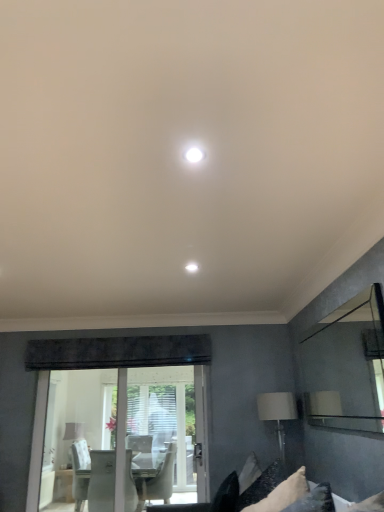
Question: Considering the relative sizes of white glossy light fixture at center and clear glass mirror at right in the image provided, is white glossy light fixture at center wider than clear glass mirror at right?

Choices:
 (A) no
 (B) yes

Answer: (B)

Question: From a real-world perspective, is white glossy light fixture at center physically below clear glass mirror at right?

Choices:
 (A) yes
 (B) no

Answer: (B)

Question: From the image's perspective, does white glossy light fixture at center appear lower than clear glass mirror at right?

Choices:
 (A) yes
 (B) no

Answer: (B)

Question: Would you consider white glossy light fixture at center to be distant from clear glass mirror at right?

Choices:
 (A) no
 (B) yes

Answer: (B)

Question: Considering the relative positions of white glossy light fixture at center and clear glass mirror at right in the image provided, is white glossy light fixture at center in front of clear glass mirror at right?

Choices:
 (A) yes
 (B) no

Answer: (A)

Question: From the image's perspective, would you say white glossy light fixture at center is positioned over clear glass mirror at right?

Choices:
 (A) no
 (B) yes

Answer: (B)

Question: Could you tell me if white glossy light fixture at center is facing white fabric pillow at lower right?

Choices:
 (A) yes
 (B) no

Answer: (B)

Question: Can you confirm if white glossy light fixture at center is thinner than white fabric pillow at lower right?

Choices:
 (A) yes
 (B) no

Answer: (A)

Question: From the image's perspective, is white glossy light fixture at center located above white fabric pillow at lower right?

Choices:
 (A) yes
 (B) no

Answer: (A)

Question: Can you confirm if white glossy light fixture at center is positioned to the right of white fabric pillow at lower right?

Choices:
 (A) no
 (B) yes

Answer: (A)

Question: Is white glossy light fixture at center wider than white fabric pillow at lower right?

Choices:
 (A) no
 (B) yes

Answer: (A)

Question: Is white glossy light fixture at center in front of white fabric pillow at lower right?

Choices:
 (A) yes
 (B) no

Answer: (A)

Question: Does clear glass mirror at right have a greater width compared to white fabric pillow at lower right?

Choices:
 (A) no
 (B) yes

Answer: (A)